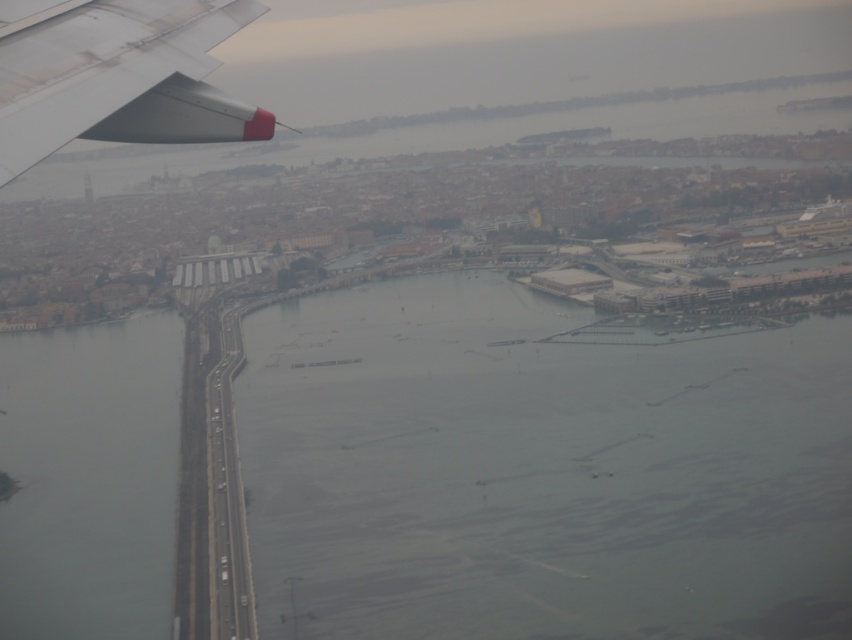
Can you confirm if gray water at center is wider than gray concrete bridge at lower left?

Correct, the width of gray water at center exceeds that of gray concrete bridge at lower left.

Measure the distance between gray water at center and camera.

The distance of gray water at center from camera is 636.78 meters.

Find the location of `gray water at center`. gray water at center is located at coordinates (539, 468).

Does gray concrete bridge at lower left appear on the left side of matte white wing at upper left?

Yes, gray concrete bridge at lower left is to the left of matte white wing at upper left.

Between point (35, 435) and point (78, 12), which one is positioned behind?

The point (35, 435) is more distant.

Identify the location of gray concrete bridge at lower left. (89, 477).

Can you confirm if gray water at center is wider than matte white wing at upper left?

Yes.

Where is `gray water at center`? The image size is (852, 640). gray water at center is located at coordinates (539, 468).